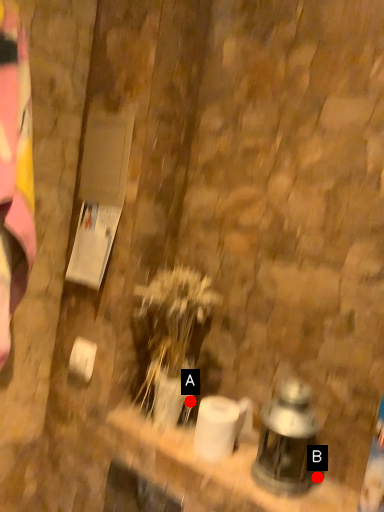
Question: Two points are circled on the image, labeled by A and B beside each circle. Which point appears closest to the camera in this image?

Choices:
 (A) A is closer
 (B) B is closer

Answer: (B)